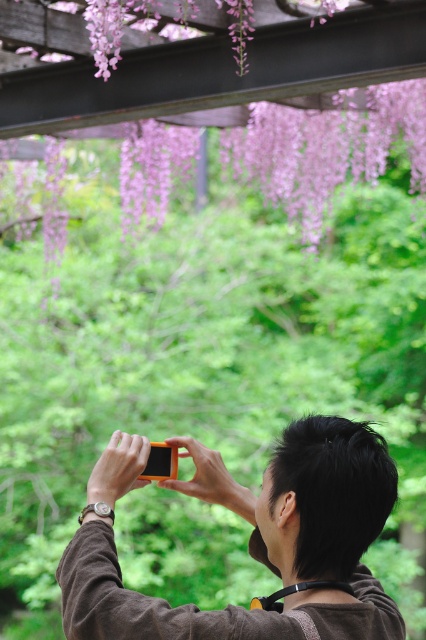
Question: Which point is farther from the camera taking this photo?

Choices:
 (A) (241, 492)
 (B) (204, 52)

Answer: (B)

Question: Which point is farther to the camera?

Choices:
 (A) purple matte flowers at upper center
 (B) orange matte camera at center

Answer: (A)

Question: Can you confirm if orange matte camera at center is positioned above purple matte flowers at upper center?

Choices:
 (A) yes
 (B) no

Answer: (B)

Question: Is orange matte camera at center positioned in front of purple matte flowers at upper center?

Choices:
 (A) no
 (B) yes

Answer: (B)

Question: Which point appears farthest from the camera in this image?

Choices:
 (A) (287, 570)
 (B) (210, 83)

Answer: (B)

Question: Does orange matte camera at center have a lesser width compared to purple matte flowers at upper center?

Choices:
 (A) yes
 (B) no

Answer: (A)